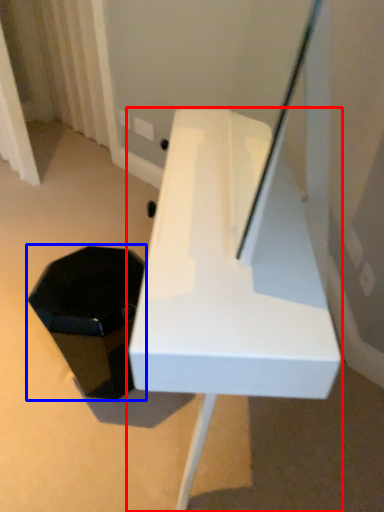
Question: Which point is closer to the camera, furniture (highlighted by a red box) or storage box (highlighted by a blue box)?

Choices:
 (A) furniture
 (B) storage box

Answer: (A)